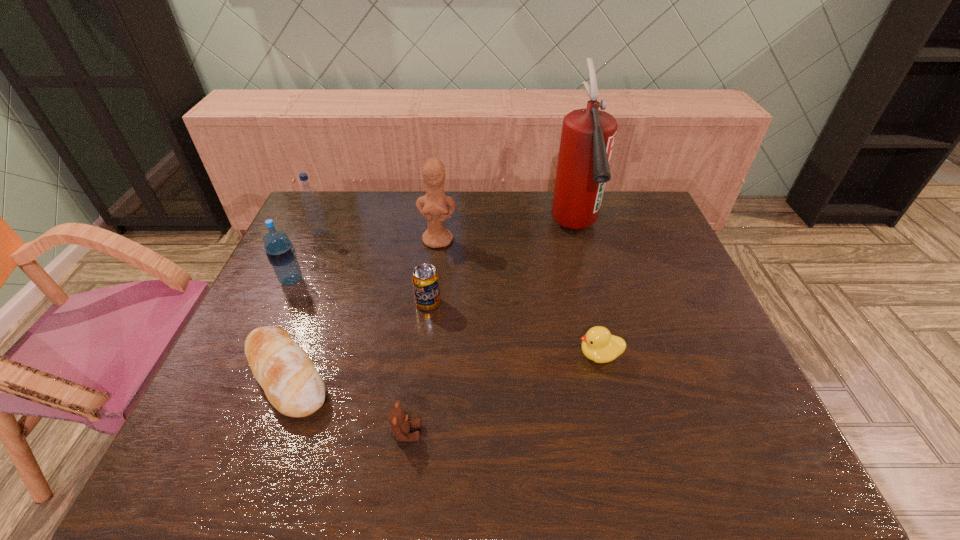
Locate an element on the screen. This screenshot has width=960, height=540. free spot between the teddy bear and the bread is located at coordinates (347, 404).

Where is `unoccupied area between the fifth tallest object and the duckling`? The height and width of the screenshot is (540, 960). unoccupied area between the fifth tallest object and the duckling is located at coordinates (514, 329).

Identify which object is the sixth nearest to the duckling. Please provide its 2D coordinates. Your answer should be formatted as a tuple, i.e. [(x, y)], where the tuple contains the x and y coordinates of a point satisfying the conditions above.

[(280, 251)]

Where is `the seventh closest object to the fire extinguisher`? Image resolution: width=960 pixels, height=540 pixels. the seventh closest object to the fire extinguisher is located at coordinates (280, 251).

This screenshot has width=960, height=540. In order to click on vacant position in the image that satisfies the following two spatial constraints: 1. on the front-facing side of the second tallest object; 2. on the face of the teddy bear in this screenshot , I will do `click(417, 433)`.